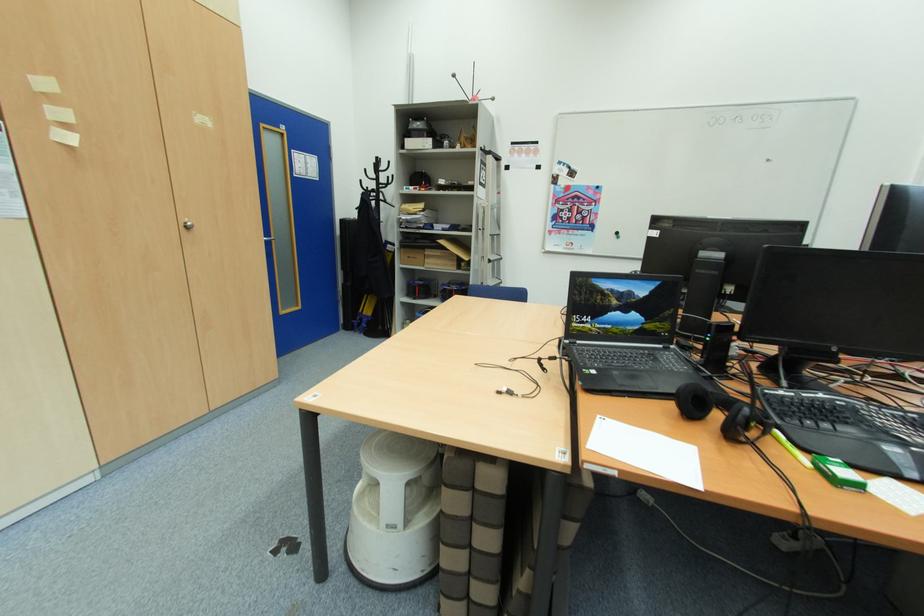
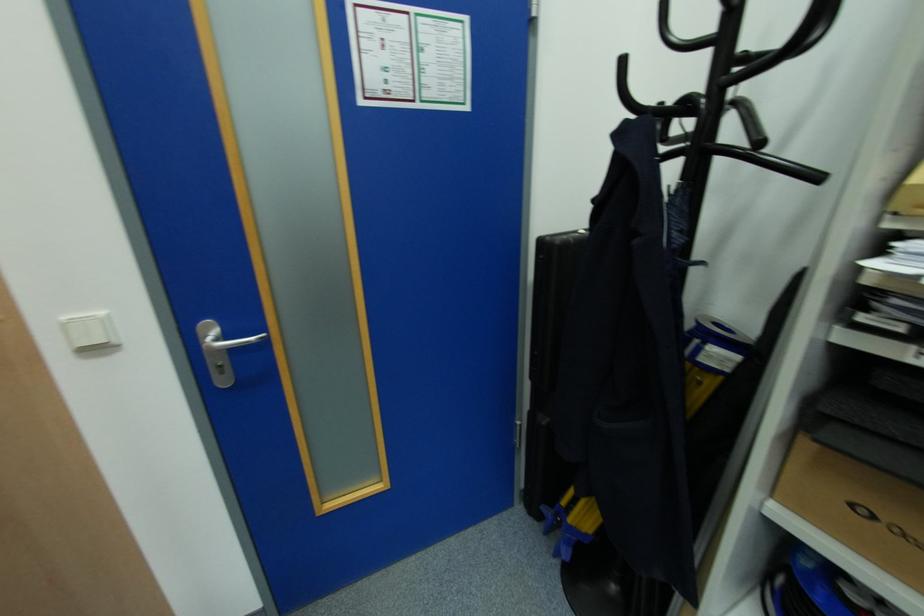
Where in the second image is the point corresponding to point (382, 185) from the first image?

(726, 61)